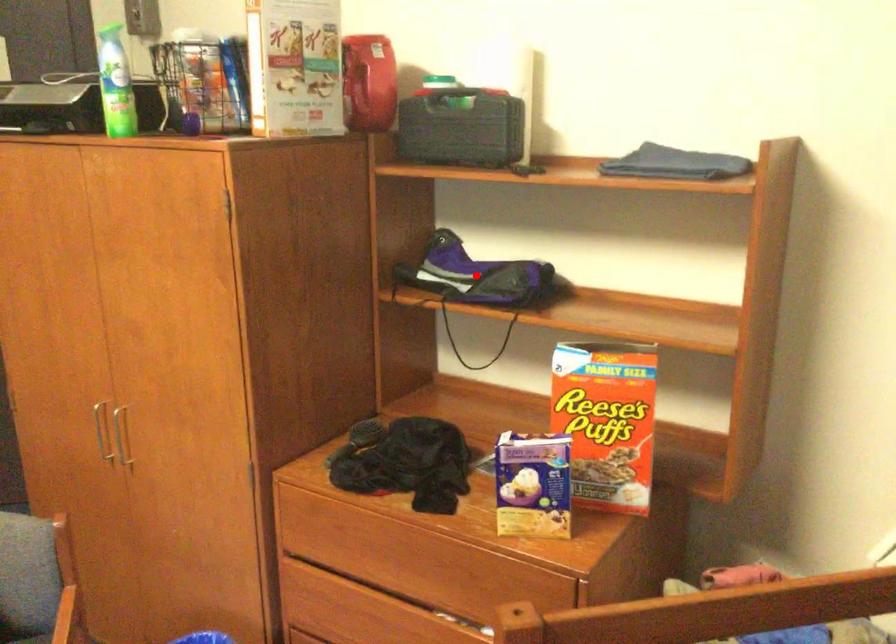
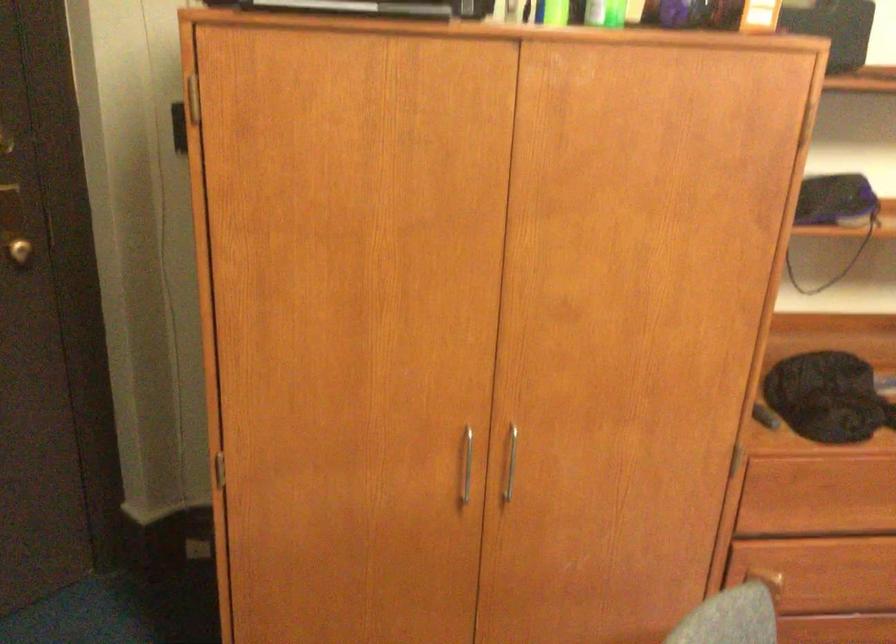
Question: I am providing you with two images of the same scene from different viewpoints. A red point is marked on the first image. Can you still see the location of the red point in image 2?

Choices:
 (A) Yes
 (B) No

Answer: (B)